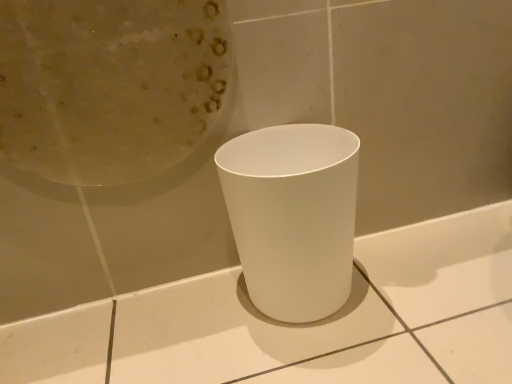
Question: Should I look upward or downward to see white matte vase at center?

Choices:
 (A) down
 (B) up

Answer: (A)